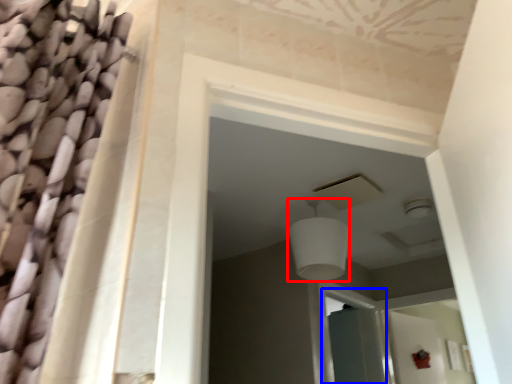
Question: Which object appears farthest to the camera in this image, light fixture (highlighted by a red box) or screen door (highlighted by a blue box)?

Choices:
 (A) light fixture
 (B) screen door

Answer: (B)